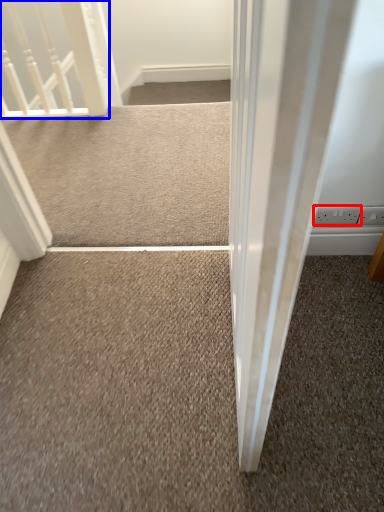
Question: Which of the following is the closest to the observer, electric outlet (highlighted by a red box) or rail (highlighted by a blue box)?

Choices:
 (A) electric outlet
 (B) rail

Answer: (A)